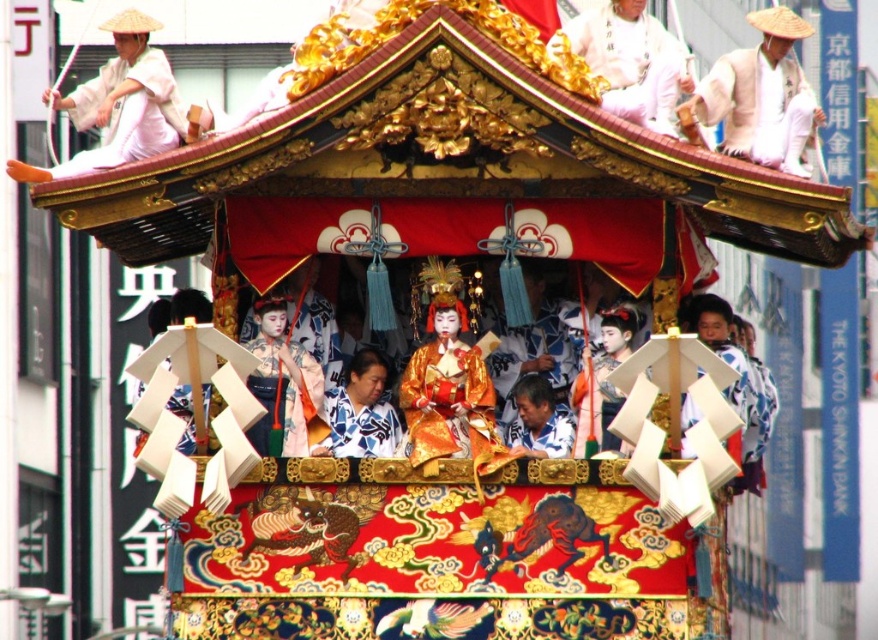
Question: Where is matte pink kimono at center located in relation to matte gold mask at center in the image?

Choices:
 (A) above
 (B) below

Answer: (A)

Question: Which of these objects is positioned farthest from the white cotton hat at upper right?

Choices:
 (A) golden silk kimono at center
 (B) white cotton kimono at upper center
 (C) matte gold mask at center

Answer: (A)

Question: From the image, what is the correct spatial relationship of white cotton kimono at upper center in relation to matte pink kimono at center?

Choices:
 (A) right
 (B) left

Answer: (A)

Question: Among these objects, which one is farthest from the camera?

Choices:
 (A) white cotton kimono at upper center
 (B) white cotton hat at upper right
 (C) matte pink kimono at center
 (D) matte gold mask at center

Answer: (C)

Question: Can you confirm if blue and white kimono at center is positioned to the left of matte white shirt at center?

Choices:
 (A) yes
 (B) no

Answer: (A)

Question: Which object is farther from the camera taking this photo?

Choices:
 (A) white cotton kimono at upper left
 (B) blue and white kimono at center
 (C) white cotton hat at upper right
 (D) matte white shirt at center

Answer: (B)